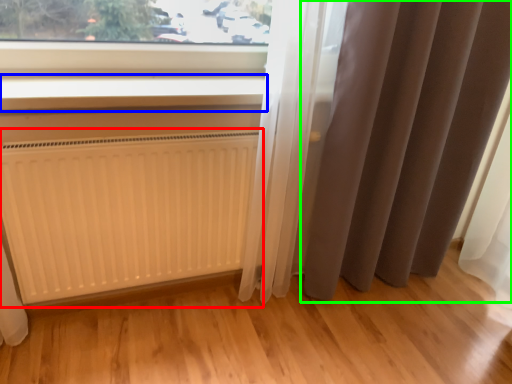
Question: Which is nearer to the radiator (highlighted by a red box)? window sill (highlighted by a blue box) or curtain (highlighted by a green box).

Choices:
 (A) window sill
 (B) curtain

Answer: (A)